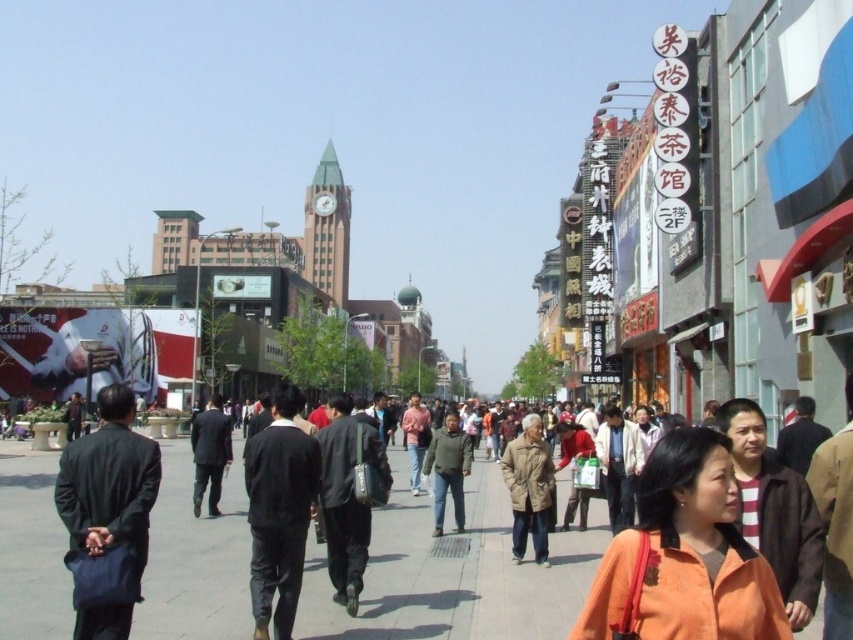
Question: Which point is farther from the camera taking this photo?

Choices:
 (A) (196, 490)
 (B) (70, 486)

Answer: (A)

Question: Does black matte jacket at center appear on the right side of black leather jacket at center?

Choices:
 (A) yes
 (B) no

Answer: (B)

Question: Estimate the real-world distances between objects in this image. Which object is closer to the tan fabric coat at center?

Choices:
 (A) black matte jacket at center
 (B) orange fabric jacket at lower right

Answer: (A)

Question: Can you confirm if orange fabric jacket at lower right is thinner than dark gray suit at center?

Choices:
 (A) no
 (B) yes

Answer: (A)

Question: Among these points, which one is nearest to the camera?

Choices:
 (A) 196,499
 (B) 352,480
 (C) 544,508

Answer: (B)

Question: Is dark gray suit at left bigger than black matte jacket at center?

Choices:
 (A) yes
 (B) no

Answer: (B)